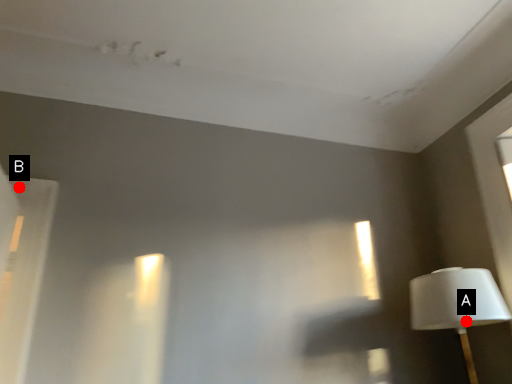
Question: Two points are circled on the image, labeled by A and B beside each circle. Which point is closer to the camera?

Choices:
 (A) A is closer
 (B) B is closer

Answer: (A)